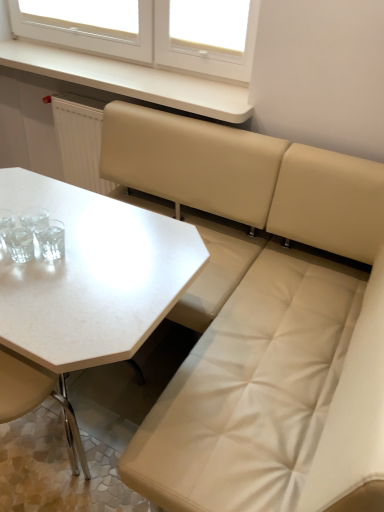
The width and height of the screenshot is (384, 512). I want to click on white matte table at center, so click(x=92, y=276).

What do you see at coordinates (37, 399) in the screenshot? The image size is (384, 512). I see `beige leather chair at lower left` at bounding box center [37, 399].

You are a GUI agent. You are given a task and a screenshot of the screen. Output one action in this format:
    pyautogui.click(x=<x>, y=<y>)
    Task: Click on the beige leather chair at lower left
    The height and width of the screenshot is (512, 384).
    Given the screenshot: What is the action you would take?
    pyautogui.click(x=37, y=399)

What is the approximate width of white matte counter top at upper center?

white matte counter top at upper center is 12.31 inches in width.

Where is `white matte table at center`? This screenshot has width=384, height=512. white matte table at center is located at coordinates (92, 276).

Considering the points (148, 71) and (83, 287), which point is behind, point (148, 71) or point (83, 287)?

The point (148, 71) is farther from the camera.

Is white matte counter top at upper center outside of white matte table at center?

Yes.

How different are the orientations of white matte counter top at upper center and white matte table at center in degrees?

1.72 degrees separate the facing orientations of white matte counter top at upper center and white matte table at center.

From a real-world perspective, is white matte counter top at upper center positioned under white matte table at center based on gravity?

No, from a real-world perspective, white matte counter top at upper center is not below white matte table at center.

Consider the image. Who is smaller, white matte counter top at upper center or beige leather chair at lower left?

white matte counter top at upper center is smaller.

Are white matte counter top at upper center and beige leather chair at lower left making contact?

white matte counter top at upper center and beige leather chair at lower left are clearly separated.

Which is behind, point (77, 78) or point (63, 393)?

The point (77, 78) is farther.

Between white matte counter top at upper center and beige leather chair at lower left, which one has smaller width?

beige leather chair at lower left.

Which object is further away from the camera, white matte table at center or transparent plastic at upper center?

Positioned behind is transparent plastic at upper center.

The width and height of the screenshot is (384, 512). Find the location of `table below the transparent plastic at upper center (from the image's perspective)`. table below the transparent plastic at upper center (from the image's perspective) is located at coordinates (92, 276).

Is white matte table at center not within transparent plastic at upper center?

Yes.

Can you tell me how much white matte table at center and transparent plastic at upper center differ in facing direction?

white matte table at center and transparent plastic at upper center are facing 1.49 degrees away from each other.

Considering the sizes of white matte table at center and white matte counter top at upper center in the image, is white matte table at center taller or shorter than white matte counter top at upper center?

Clearly, white matte table at center is taller compared to white matte counter top at upper center.

From a real-world perspective, does white matte table at center stand above white matte counter top at upper center?

No, from a real-world perspective, white matte table at center is not over white matte counter top at upper center

Is white matte table at center positioned beyond the bounds of white matte counter top at upper center?

Absolutely, white matte table at center is external to white matte counter top at upper center.

Considering the relative sizes of white matte table at center and white matte counter top at upper center in the image provided, is white matte table at center wider than white matte counter top at upper center?

Yes, white matte table at center is wider than white matte counter top at upper center.

Is transparent plastic at upper center positioned beyond the bounds of white matte table at center?

Yes, transparent plastic at upper center is not within white matte table at center.

In terms of size, does transparent plastic at upper center appear bigger or smaller than white matte table at center?

transparent plastic at upper center is smaller than white matte table at center.

Which is farther from the camera, [242,34] or [111,284]?

Point [242,34]

Are transparent plastic at upper center and white matte table at center located far from each other?

transparent plastic at upper center is far away from white matte table at center.

Based on the photo, between beige leather chair at lower left and white matte table at center, which one has less height?

With less height is beige leather chair at lower left.

Is beige leather chair at lower left to the left of white matte table at center from the viewer's perspective?

Indeed, beige leather chair at lower left is positioned on the left side of white matte table at center.

Considering the positions of point (64, 391) and point (17, 321), is point (64, 391) closer or farther from the camera than point (17, 321)?

Clearly, point (64, 391) is more distant from the camera than point (17, 321).

Is white matte counter top at upper center taller than transparent plastic at upper center?

No.

Where is `window screen on the right of white matte counter top at upper center`? This screenshot has width=384, height=512. window screen on the right of white matte counter top at upper center is located at coordinates (210, 24).

Based on the photo, is white matte counter top at upper center to the left of transparent plastic at upper center from the viewer's perspective?

Correct, you'll find white matte counter top at upper center to the left of transparent plastic at upper center.

From a real-world perspective, is white matte counter top at upper center positioned above or below transparent plastic at upper center?

In terms of real-world spatial position, white matte counter top at upper center is below transparent plastic at upper center.

The height and width of the screenshot is (512, 384). I want to click on counter top lying behind the white matte table at center, so pyautogui.click(x=131, y=80).

Find the location of a particular element. The image size is (384, 512). counter top above the beige leather chair at lower left (from a real-world perspective) is located at coordinates click(131, 80).

Looking at the image, which one is located closer to white matte table at center, transparent plastic at upper center or white matte counter top at upper center?

white matte counter top at upper center is closer to white matte table at center.

When comparing their distances from white matte table at center, does white matte counter top at upper center or transparent plastic at upper center seem further?

transparent plastic at upper center lies further to white matte table at center than the other object.

Which object lies further to the anchor point transparent plastic at upper center, beige leather chair at lower left or white matte counter top at upper center?

Among the two, beige leather chair at lower left is located further to transparent plastic at upper center.

Estimate the real-world distances between objects in this image. Which object is further from white matte table at center, beige leather chair at lower left or transparent plastic at upper center?

transparent plastic at upper center.

Which object lies nearer to the anchor point transparent plastic at upper center, white matte table at center or beige leather chair at lower left?

white matte table at center is closer to transparent plastic at upper center.

Looking at the image, which one is located closer to beige leather chair at lower left, white matte counter top at upper center or white matte table at center?

white matte table at center is closer to beige leather chair at lower left.

When comparing their distances from white matte table at center, does transparent plastic at upper center or beige leather chair at lower left seem further?

transparent plastic at upper center.

Which object lies nearer to the anchor point transparent plastic at upper center, white matte counter top at upper center or white matte table at center?

white matte counter top at upper center is closer to transparent plastic at upper center.

In order to click on table between white matte counter top at upper center and beige leather chair at lower left in the vertical direction in this screenshot , I will do point(92,276).

Where is `counter top between transparent plastic at upper center and beige leather chair at lower left in the vertical direction`? This screenshot has height=512, width=384. counter top between transparent plastic at upper center and beige leather chair at lower left in the vertical direction is located at coordinates (131, 80).

This screenshot has width=384, height=512. In order to click on counter top between transparent plastic at upper center and white matte table at center vertically in this screenshot , I will do `click(131, 80)`.

This screenshot has height=512, width=384. I want to click on table between transparent plastic at upper center and beige leather chair at lower left in the up-down direction, so click(92, 276).